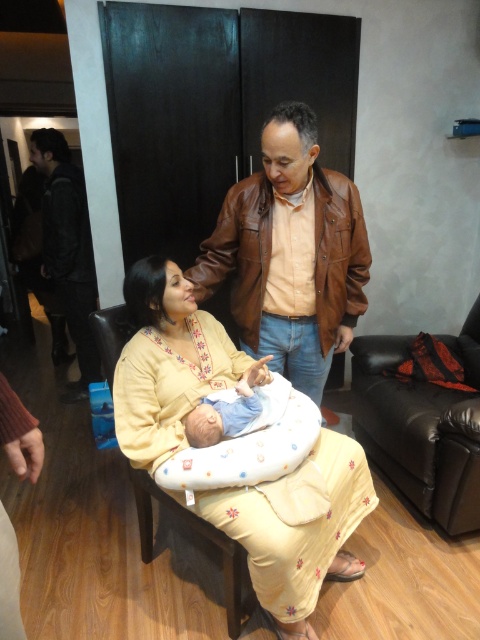
Where is `black leather armchair at right`? black leather armchair at right is located at coordinates (418, 433).

Does point (470, 348) lie behind point (134, 496)?

Yes.

Which is in front, point (422, 420) or point (104, 339)?

Positioned in front is point (104, 339).

The height and width of the screenshot is (640, 480). I want to click on black leather armchair at right, so click(x=418, y=433).

Is light brown fabric armchair at center smaller than blue cotton newborn at center?

Actually, light brown fabric armchair at center might be larger than blue cotton newborn at center.

At what (x,y) coordinates should I click in order to perform the action: click on light brown fabric armchair at center. Please return your answer as a coordinate pair (x, y). Looking at the image, I should click on (202, 536).

Which is in front, point (247, 598) or point (220, 416)?

Point (220, 416) is more forward.

At what (x,y) coordinates should I click in order to perform the action: click on light brown fabric armchair at center. Please return your answer as a coordinate pair (x, y). This screenshot has height=640, width=480. Looking at the image, I should click on (202, 536).

Can you confirm if black leather armchair at right is smaller than blue cotton newborn at center?

Actually, black leather armchair at right might be larger than blue cotton newborn at center.

Which is more to the right, black leather armchair at right or blue cotton newborn at center?

Positioned to the right is black leather armchair at right.

In order to click on black leather armchair at right in this screenshot , I will do `click(418, 433)`.

At what (x,y) coordinates should I click in order to perform the action: click on black leather armchair at right. Please return your answer as a coordinate pair (x, y). The image size is (480, 640). Looking at the image, I should click on (418, 433).